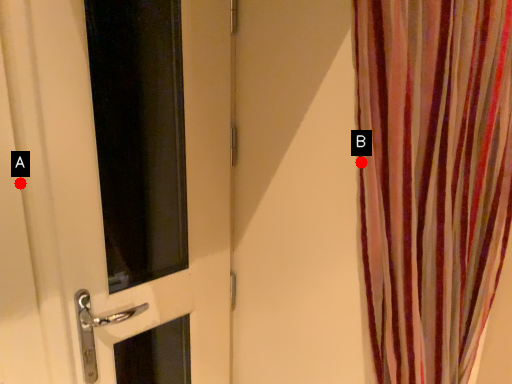
Question: Two points are circled on the image, labeled by A and B beside each circle. Among these points, which one is farthest from the camera?

Choices:
 (A) A is further
 (B) B is further

Answer: (A)